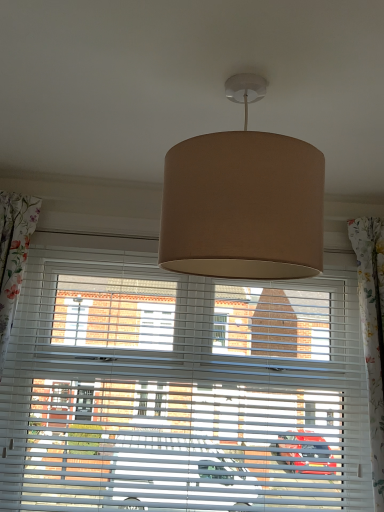
Question: Looking at the image, does beige fabric lampshade at center seem bigger or smaller compared to white matte window blind at center?

Choices:
 (A) small
 (B) big

Answer: (A)

Question: From a real-world perspective, is beige fabric lampshade at center positioned above or below white matte window blind at center?

Choices:
 (A) below
 (B) above

Answer: (B)

Question: Considering the positions of beige fabric lampshade at center and white matte window blind at center in the image, is beige fabric lampshade at center wider or thinner than white matte window blind at center?

Choices:
 (A) wide
 (B) thin

Answer: (A)

Question: In terms of height, does white matte window blind at center look taller or shorter compared to beige fabric lampshade at center?

Choices:
 (A) tall
 (B) short

Answer: (A)

Question: Is white matte window blind at center inside or outside of beige fabric lampshade at center?

Choices:
 (A) outside
 (B) inside

Answer: (A)

Question: Is white matte window blind at center bigger or smaller than beige fabric lampshade at center?

Choices:
 (A) big
 (B) small

Answer: (A)

Question: From a real-world perspective, is white matte window blind at center above or below beige fabric lampshade at center?

Choices:
 (A) below
 (B) above

Answer: (A)